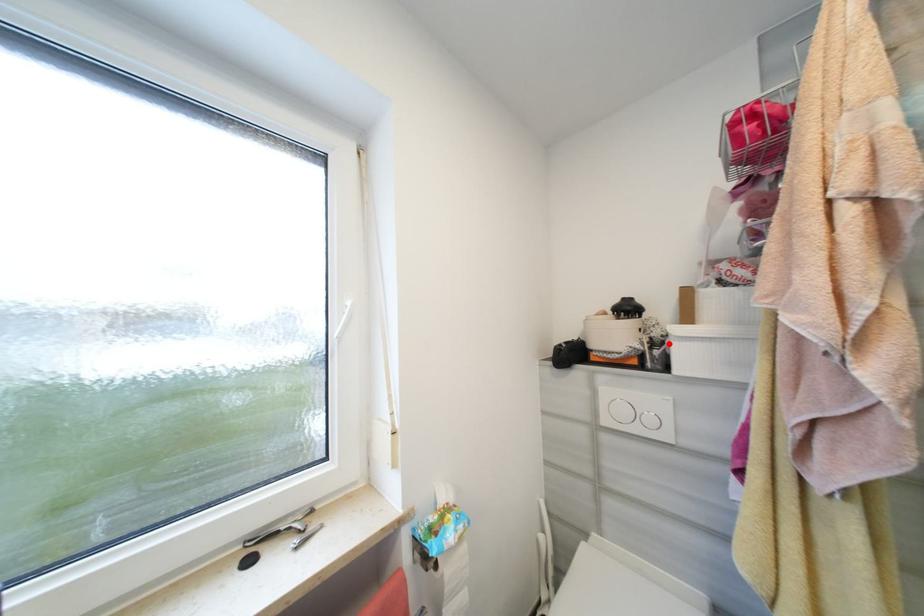
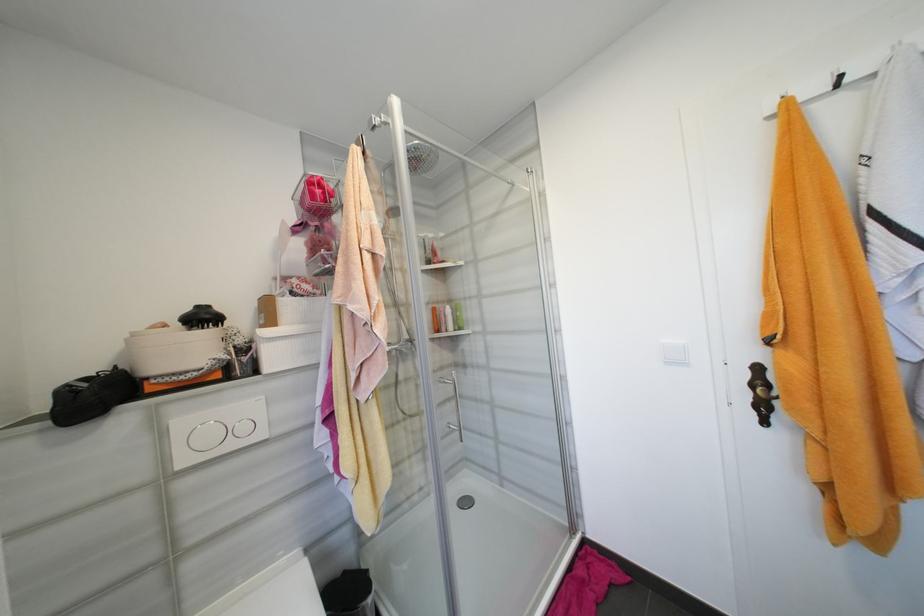
In the second image, find the point that corresponds to the highlighted location in the first image.

(256, 349)